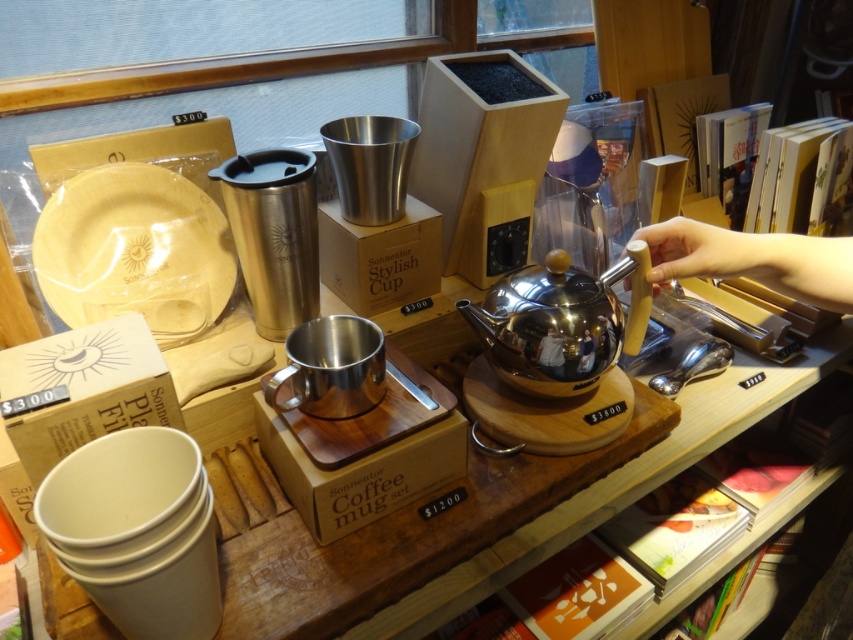
Question: Which point is closer to the camera?

Choices:
 (A) (827, 257)
 (B) (161, 205)
 (C) (642, 248)

Answer: (A)

Question: Which object is positioned closest to the shiny metallic teapot at center?

Choices:
 (A) metallic cardboard box at center
 (B) shiny stainless steel teapot at center
 (C) matte black coffee cup at upper center
 (D) matte white plate at lower left

Answer: (B)

Question: Based on their relative distances, which object is farther from the natural wood plate at left?

Choices:
 (A) matte white plate at lower left
 (B) shiny metallic teapot at center
 (C) wooden spoon at upper right
 (D) matte black coffee cup at upper center

Answer: (C)

Question: Is shiny stainless steel teapot at center positioned behind matte white plate at lower left?

Choices:
 (A) yes
 (B) no

Answer: (A)

Question: Is natural wood plate at left bigger than matte white plate at lower left?

Choices:
 (A) no
 (B) yes

Answer: (A)

Question: Can you confirm if shiny metallic teapot at center is positioned to the left of metallic cardboard box at center?

Choices:
 (A) yes
 (B) no

Answer: (B)